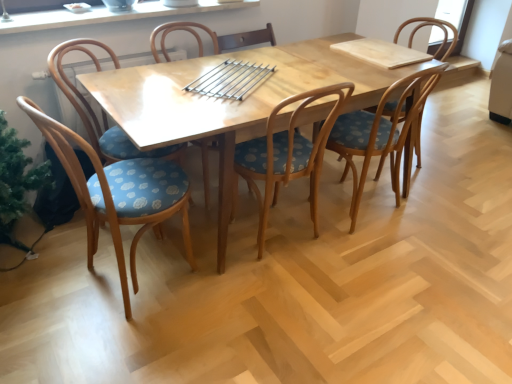
In order to click on free point to the right of blue polka dot fabric chair at center, which appears as the 6th chair when viewed from the left in this screenshot , I will do pyautogui.click(x=457, y=166).